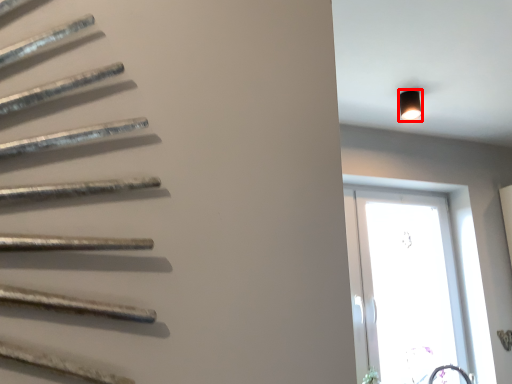
Question: From the image, what is the correct spatial relationship of light fixture (annotated by the red box) in relation to window?

Choices:
 (A) right
 (B) left

Answer: (B)